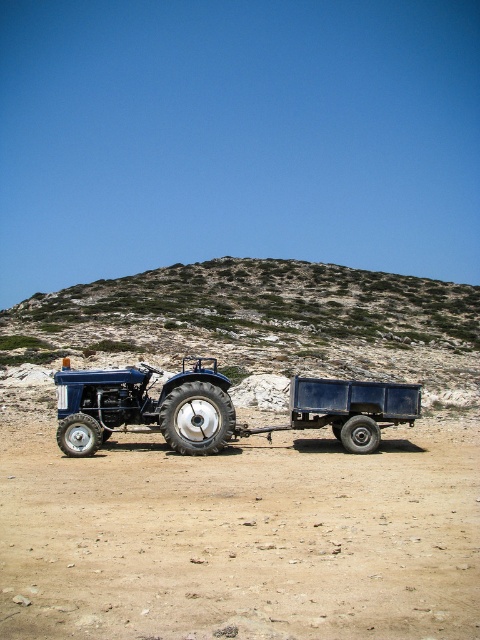
You are a farmer planning to plant crops in the brown sandy soil at center. The metallic blue tractor at center is currently parked there. Can the tractor be moved to another area so you can access the soil for planting?

The brown sandy soil at center is larger in size than the metallic blue tractor at center, so yes, the tractor can be moved to another area to allow access to the soil for planting.